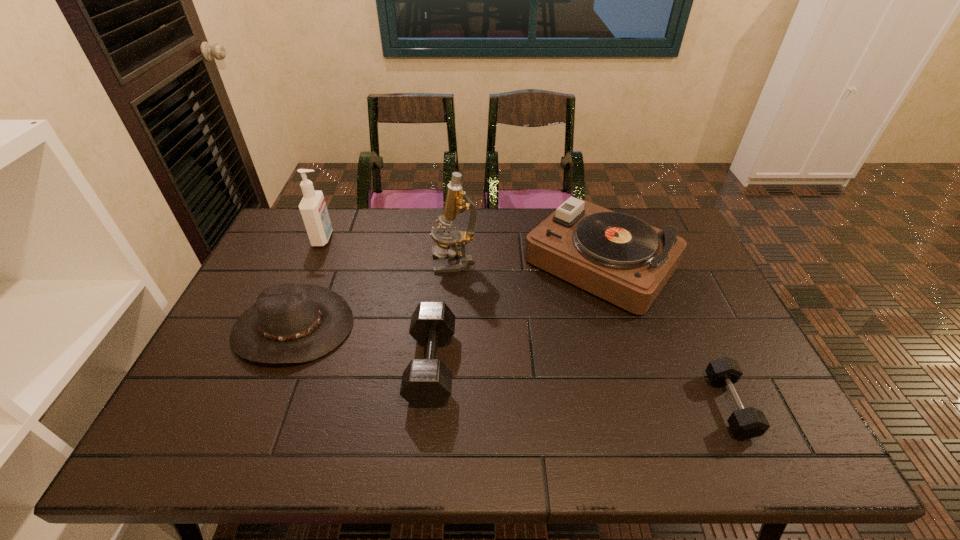
Locate an element on the screen. This screenshot has height=540, width=960. free space at the near right corner is located at coordinates (732, 449).

The image size is (960, 540). Find the location of `vacant space that is in between the record player and the left dumbbell`. vacant space that is in between the record player and the left dumbbell is located at coordinates 516,314.

The width and height of the screenshot is (960, 540). In order to click on free point between the second tallest object and the left dumbbell in this screenshot , I will do `click(377, 302)`.

In order to click on vacant space in between the shorter dumbbell and the hat in this screenshot , I will do `click(512, 366)`.

Image resolution: width=960 pixels, height=540 pixels. I want to click on free spot between the tallest object and the hat, so pos(374,294).

Locate an element on the screen. This screenshot has height=540, width=960. free space between the record player and the hat is located at coordinates (447, 295).

Where is `empty space between the shorter dumbbell and the hat`? empty space between the shorter dumbbell and the hat is located at coordinates (512, 366).

The height and width of the screenshot is (540, 960). Find the location of `free area in between the hat and the left dumbbell`. free area in between the hat and the left dumbbell is located at coordinates (363, 346).

Locate an element on the screen. This screenshot has width=960, height=540. object that is the nearest to the shorter dumbbell is located at coordinates (620, 258).

Where is `object identified as the fourth closest to the fourth shortest object`? This screenshot has height=540, width=960. object identified as the fourth closest to the fourth shortest object is located at coordinates (290, 323).